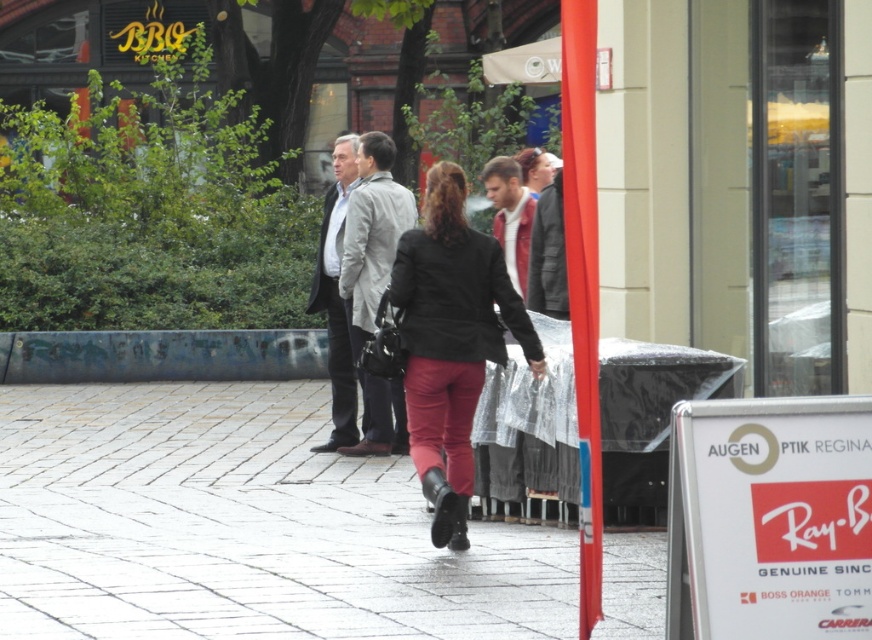
You are standing at the point where the person in the black jacket and red pants is currently located. The smooth stone pavement at center is at coordinates 0.825, 0.278. Can you walk directly towards it without moving past the person?

Yes, since the smooth stone pavement at center is located at coordinates (x=242, y=528), you can walk directly towards it without moving past the person as the coordinates indicate its position relative to your current location.

You are a photographer trying to capture a clear shot of both the matte black jacket at center and the dark gray wool coat at center. Since you want to focus on the larger object, which one should you adjust your camera settings for?

The matte black jacket at center is larger in size than the dark gray wool coat at center, so you should adjust your camera settings to focus on the matte black jacket at center.